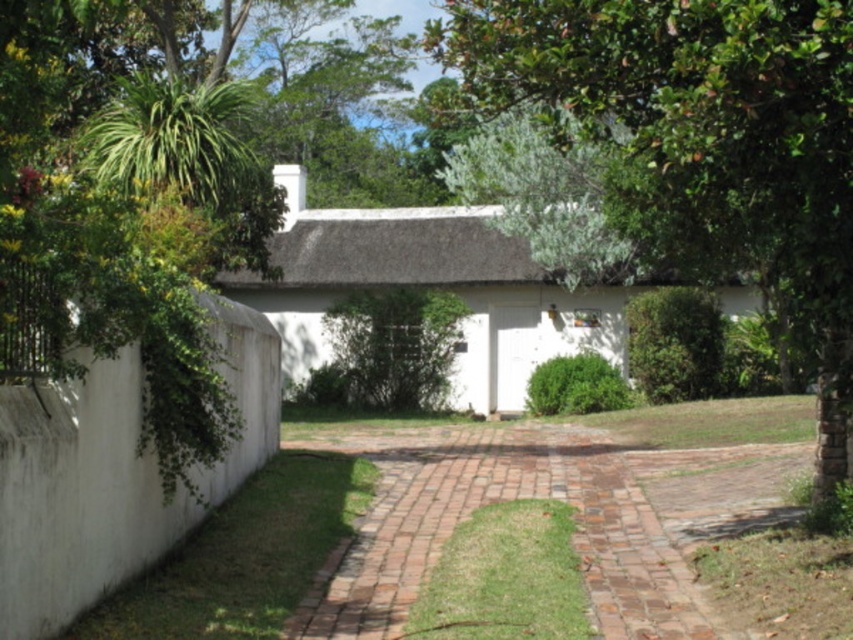
Question: Which object is positioned closest to the white matte cottage at center?

Choices:
 (A) green leafy tree at center
 (B) brick paved path at center

Answer: (A)

Question: Which point is farther to the camera?

Choices:
 (A) (758, 20)
 (B) (730, 312)

Answer: (B)

Question: Can you confirm if green leafy tree at center is wider than white matte cottage at center?

Choices:
 (A) yes
 (B) no

Answer: (B)

Question: Does brick paved path at center have a greater width compared to white matte cottage at center?

Choices:
 (A) no
 (B) yes

Answer: (A)

Question: Which point appears farthest from the camera in this image?

Choices:
 (A) (538, 490)
 (B) (822, 200)
 (C) (274, 314)

Answer: (C)

Question: Does green leafy tree at center have a greater width compared to white matte cottage at center?

Choices:
 (A) no
 (B) yes

Answer: (A)